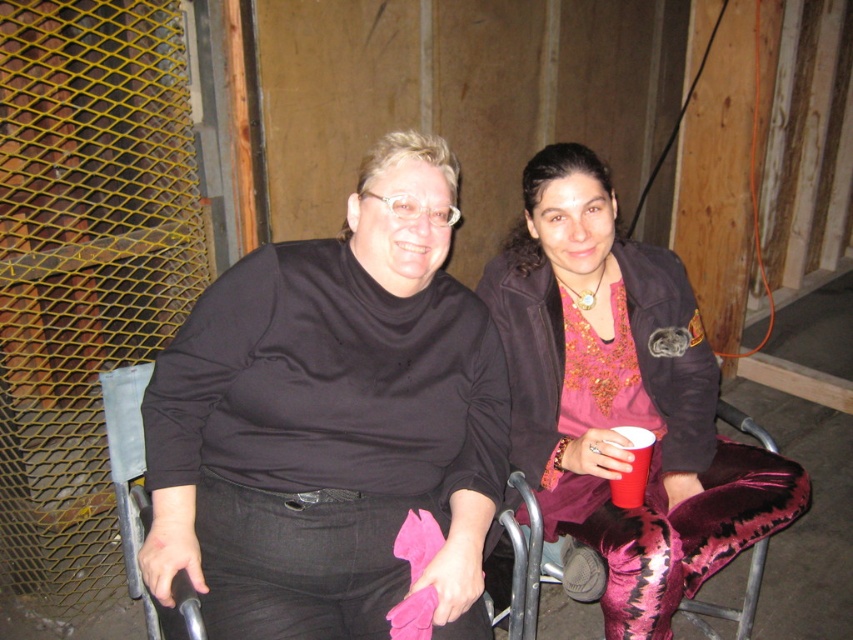
Does point (376, 157) come farther from viewer compared to point (653, 445)?

No, it is in front of (653, 445).

Consider the image. Who is more forward, (374, 154) or (630, 476)?

Point (374, 154) is in front.

The width and height of the screenshot is (853, 640). What do you see at coordinates (614, 401) in the screenshot?
I see `velvet leggings at center` at bounding box center [614, 401].

In order to click on velvet leggings at center in this screenshot , I will do `click(614, 401)`.

Can you confirm if velvet pink pants at center is positioned below red plastic cup at right?

No, velvet pink pants at center is not below red plastic cup at right.

Based on the photo, is velvet pink pants at center further to the viewer compared to red plastic cup at right?

That is False.

Find the location of a particular element. This screenshot has height=640, width=853. velvet pink pants at center is located at coordinates click(x=621, y=397).

Is velvet purple chair at center smaller than red plastic cup at right?

Actually, velvet purple chair at center might be larger than red plastic cup at right.

Does velvet purple chair at center have a greater height compared to red plastic cup at right?

Correct, velvet purple chair at center is much taller as red plastic cup at right.

Is point (759, 576) in front of point (630, 429)?

No, (759, 576) is further to viewer.

I want to click on velvet purple chair at center, so click(729, 605).